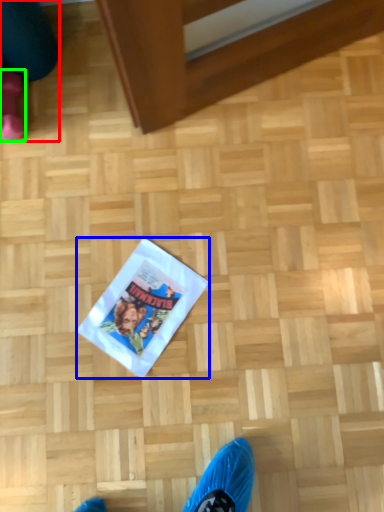
Question: Which is nearer to the leg (highlighted by a red box)? flyer (highlighted by a blue box) or footwear (highlighted by a green box).

Choices:
 (A) flyer
 (B) footwear

Answer: (B)